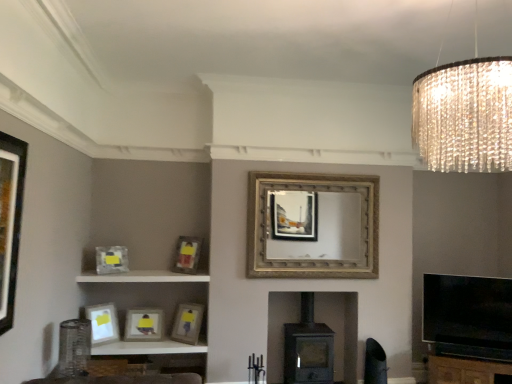
This screenshot has height=384, width=512. What are the coordinates of `black glossy tv at right` in the screenshot? It's located at (468, 316).

How much space does matte black picture frame at left, the 1th picture frame in the front-to-back sequence, occupy horizontally?

The width of matte black picture frame at left, the 1th picture frame in the front-to-back sequence, is 7.85 centimeters.

Image resolution: width=512 pixels, height=384 pixels. Describe the element at coordinates (375, 363) in the screenshot. I see `black leather swivel chair at lower right` at that location.

You are a GUI agent. You are given a task and a screenshot of the screen. Output one action in this format:
    pyautogui.click(x=<x>, y=<y>)
    Task: Click on the matte gray picture frame at left, the 2th picture frame in the left-to-right sequence
    The width and height of the screenshot is (512, 384).
    Given the screenshot: What is the action you would take?
    pyautogui.click(x=111, y=260)

In terms of size, does black leather swivel chair at lower right appear bigger or smaller than clear crystal chandelier at upper right?

Considering their sizes, black leather swivel chair at lower right takes up less space than clear crystal chandelier at upper right.

Measure the distance between black leather swivel chair at lower right and clear crystal chandelier at upper right.

black leather swivel chair at lower right and clear crystal chandelier at upper right are 9.07 feet apart.

From a real-world perspective, is black leather swivel chair at lower right over clear crystal chandelier at upper right?

Incorrect, from a real-world perspective, black leather swivel chair at lower right is lower than clear crystal chandelier at upper right.

Locate an element on the screen. Image resolution: width=512 pixels, height=384 pixels. lamp above the black leather swivel chair at lower right (from a real-world perspective) is located at coordinates (464, 114).

Who is taller, matte gray picture frame at left, the 2th picture frame in the left-to-right sequence, or matte wooden picture frame at lower center, which is the 2th picture frame in right-to-left order?

With more height is matte wooden picture frame at lower center, which is the 2th picture frame in right-to-left order.

Considering the sizes of matte gray picture frame at left, the 3th picture frame from the front, and matte wooden picture frame at lower center, which is the 2th picture frame in right-to-left order, in the image, is matte gray picture frame at left, the 3th picture frame from the front, wider or thinner than matte wooden picture frame at lower center, which is the 2th picture frame in right-to-left order,?

Clearly, matte gray picture frame at left, the 3th picture frame from the front, has less width compared to matte wooden picture frame at lower center, which is the 2th picture frame in right-to-left order.

From the image's perspective, which is below, matte gray picture frame at left, the fifth picture frame viewed from the back, or matte wooden picture frame at lower center, placed as the 5th picture frame when sorted from front to back?

matte wooden picture frame at lower center, placed as the 5th picture frame when sorted from front to back, from the image's perspective.

Considering the relative sizes of matte gray picture frame at left, arranged as the sixth picture frame when viewed from the right, and black leather swivel chair at lower right in the image provided, is matte gray picture frame at left, arranged as the sixth picture frame when viewed from the right, taller than black leather swivel chair at lower right?

No.

Is matte gray picture frame at left, the fifth picture frame viewed from the back, wider than black leather swivel chair at lower right?

No.

Does matte gray picture frame at left, the fifth picture frame viewed from the back, appear on the left side of black leather swivel chair at lower right?

Correct, you'll find matte gray picture frame at left, the fifth picture frame viewed from the back, to the left of black leather swivel chair at lower right.

From the image's perspective, which picture frame is the 4th one above the black leather swivel chair at lower right? Please provide its 2D coordinates.

[(111, 260)]

Who is taller, clear crystal chandelier at upper right or gold textured mirror at center, which is the seventh picture frame from left to right?

With more height is gold textured mirror at center, which is the seventh picture frame from left to right.

In the image, there is a gold textured mirror at center, arranged as the 1th picture frame when viewed from the right. At what (x,y) coordinates should I click in order to perform the action: click on lamp above it (from the image's perspective). Please return your answer as a coordinate pair (x, y). The image size is (512, 384). Looking at the image, I should click on (464, 114).

Choose the correct answer: Is clear crystal chandelier at upper right inside gold textured mirror at center, arranged as the 1th picture frame when viewed from the right, or outside it?

clear crystal chandelier at upper right cannot be found inside gold textured mirror at center, arranged as the 1th picture frame when viewed from the right.

Which is closer, (x=430, y=70) or (x=354, y=190)?

The point (x=430, y=70) is closer to the camera.

Considering the sizes of objects black glossy tv at right and matte white picture frame at lower left, arranged as the 2th picture frame when viewed from the front, in the image provided, who is wider, black glossy tv at right or matte white picture frame at lower left, arranged as the 2th picture frame when viewed from the front,?

black glossy tv at right.

From the image's perspective, which is above, black glossy tv at right or matte white picture frame at lower left, the first picture frame viewed from the left?

black glossy tv at right.

You are a GUI agent. You are given a task and a screenshot of the screen. Output one action in this format:
    pyautogui.click(x=<x>, y=<y>)
    Task: Click on the television in front of the matte white picture frame at lower left, which is the 7th picture frame from right to left
    The width and height of the screenshot is (512, 384).
    Given the screenshot: What is the action you would take?
    pyautogui.click(x=468, y=316)

What's the angular difference between black glossy tv at right and matte white picture frame at lower left, arranged as the 2th picture frame when viewed from the front,'s facing directions?

They differ by 71.7 degrees in their facing directions.

Would you say black leather swivel chair at lower right is part of brown wooden dresser at lower right's contents?

No, black leather swivel chair at lower right is not a part of brown wooden dresser at lower right.

Which object is further away from the camera, brown wooden dresser at lower right or black leather swivel chair at lower right?

black leather swivel chair at lower right is more distant.

Does brown wooden dresser at lower right touch black leather swivel chair at lower right?

No, brown wooden dresser at lower right is not with black leather swivel chair at lower right.

From a real-world perspective, is brown wooden dresser at lower right on black leather swivel chair at lower right?

No, from a real-world perspective, brown wooden dresser at lower right is not above black leather swivel chair at lower right.

In the scene shown: Considering the sizes of objects brown wooden dresser at lower right and white glossy shelf at lower left in the image provided, who is smaller, brown wooden dresser at lower right or white glossy shelf at lower left?

white glossy shelf at lower left.

Is brown wooden dresser at lower right not near white glossy shelf at lower left?

Yes, brown wooden dresser at lower right and white glossy shelf at lower left are quite far apart.

Considering the positions of objects brown wooden dresser at lower right and white glossy shelf at lower left in the image provided, who is behind, brown wooden dresser at lower right or white glossy shelf at lower left?

Positioned behind is white glossy shelf at lower left.

In the scene shown: In terms of height, does brown wooden dresser at lower right look taller or shorter compared to white glossy shelf at lower left?

brown wooden dresser at lower right is taller than white glossy shelf at lower left.

The height and width of the screenshot is (384, 512). I want to click on lamp on the left of black leather swivel chair at lower right, so click(464, 114).

This screenshot has height=384, width=512. In order to click on picture frame that is the 2nd object above the matte wooden picture frame at lower center, which is the 2th picture frame in right-to-left order (from a real-world perspective) in this screenshot , I will do `click(111, 260)`.

Which object lies further to the anchor point matte wooden picture frame at lower center, placed as the seventh picture frame when sorted from front to back, matte wooden picture frame at lower center, placed as the 5th picture frame when sorted from front to back, or matte wooden picture frame at center, which is the 3th picture frame from right to left?

matte wooden picture frame at center, which is the 3th picture frame from right to left, is positioned further to the anchor matte wooden picture frame at lower center, placed as the seventh picture frame when sorted from front to back.

Looking at the image, which one is located further to gold textured mirror at center, which is the seventh picture frame from left to right, black leather swivel chair at lower right or matte white picture frame at lower left, which is the 7th picture frame from right to left?

matte white picture frame at lower left, which is the 7th picture frame from right to left.

From the image, which object appears to be nearer to black leather swivel chair at lower right, white glossy shelf at lower left or matte white picture frame at lower left, which is the 7th picture frame from right to left?

Based on the image, white glossy shelf at lower left appears to be nearer to black leather swivel chair at lower right.

From the picture: Looking at the image, which one is located closer to matte wooden picture frame at lower center, placed as the seventh picture frame when sorted from front to back, black leather swivel chair at lower right or matte gray picture frame at left, the fifth picture frame viewed from the back?

The object closer to matte wooden picture frame at lower center, placed as the seventh picture frame when sorted from front to back, is matte gray picture frame at left, the fifth picture frame viewed from the back.

Based on their spatial positions, is matte gray picture frame at left, the 2th picture frame in the left-to-right sequence, or matte wooden picture frame at lower center, marked as the 4th picture frame in a left-to-right arrangement, further from matte wooden picture frame at center, which is the 3th picture frame from right to left?

matte wooden picture frame at lower center, marked as the 4th picture frame in a left-to-right arrangement.

When comparing their distances from matte white picture frame at lower left, which is the 7th picture frame from right to left, does matte wooden picture frame at lower center, placed as the seventh picture frame when sorted from front to back, or gold textured mirror at center, arranged as the 1th picture frame when viewed from the right, seem further?

The object further to matte white picture frame at lower left, which is the 7th picture frame from right to left, is gold textured mirror at center, arranged as the 1th picture frame when viewed from the right.

Looking at the image, which one is located further to clear crystal chandelier at upper right, brown wooden dresser at lower right or gold textured mirror at center, arranged as the 1th picture frame when viewed from the right?

brown wooden dresser at lower right.

Looking at this image, based on their spatial positions, is matte wooden picture frame at lower center, acting as the first picture frame starting from the back, or brown wooden dresser at lower right closer to black glossy tv at right?

The object closer to black glossy tv at right is brown wooden dresser at lower right.

Image resolution: width=512 pixels, height=384 pixels. I want to click on shelf between clear crystal chandelier at upper right and matte wooden picture frame at lower center, which ranks as the 3th picture frame in back-to-front order, in the front-back direction, so click(142, 277).

I want to click on shelf located between matte gray picture frame at left, the 2th picture frame in the left-to-right sequence, and matte wooden picture frame at lower center, placed as the 5th picture frame when sorted from front to back, in the left-right direction, so click(x=142, y=277).

Find the location of a particular element. The width and height of the screenshot is (512, 384). picture frame between matte wooden picture frame at lower center, acting as the sixth picture frame starting from the left, and black leather swivel chair at lower right, in the horizontal direction is located at coordinates (312, 225).

Find the location of `television located between clear crystal chandelier at upper right and matte wooden picture frame at center, which is the 3th picture frame from right to left, in the depth direction`. television located between clear crystal chandelier at upper right and matte wooden picture frame at center, which is the 3th picture frame from right to left, in the depth direction is located at coordinates click(x=468, y=316).